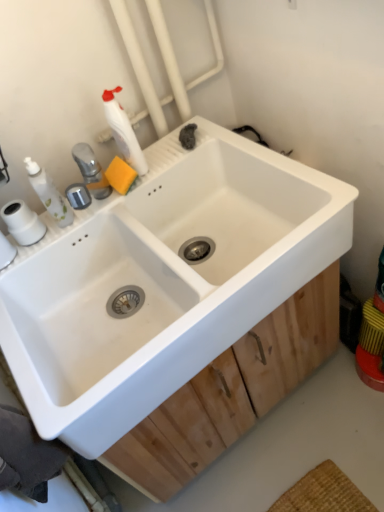
Question: From the image's perspective, is wooden at center above or below white ceramic sink at center?

Choices:
 (A) above
 (B) below

Answer: (B)

Question: Based on their positions, is wooden at center located to the left or right of white ceramic sink at center?

Choices:
 (A) left
 (B) right

Answer: (B)

Question: Which object is positioned farthest from the white matte bottle at upper left?

Choices:
 (A) white ceramic sink at center
 (B) white plastic soap dispenser at upper left
 (C) white matte toilet paper at left
 (D) wooden at center

Answer: (D)

Question: Which object is positioned farthest from the white ceramic sink at center?

Choices:
 (A) wooden at center
 (B) white plastic soap dispenser at upper left
 (C) white matte bottle at upper left
 (D) white matte toilet paper at left

Answer: (D)